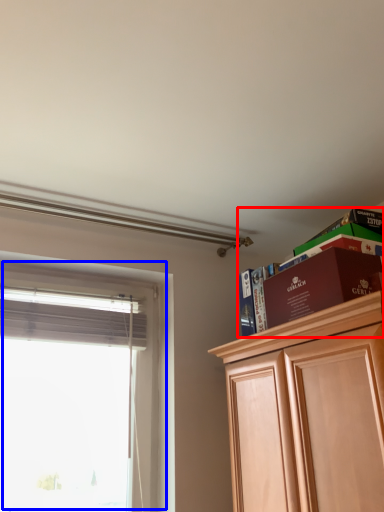
Question: Which object is further to the camera taking this photo, shelf (highlighted by a red box) or window (highlighted by a blue box)?

Choices:
 (A) shelf
 (B) window

Answer: (B)